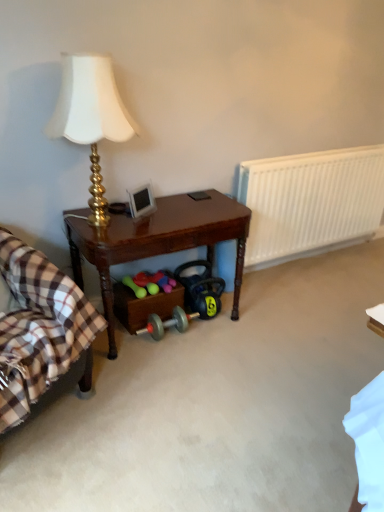
Question: From the image's perspective, relative to brown wooden table at center, is plaid fabric at left above or below?

Choices:
 (A) above
 (B) below

Answer: (B)

Question: From a real-world perspective, is plaid fabric at left above or below brown wooden table at center?

Choices:
 (A) below
 (B) above

Answer: (B)

Question: Estimate the real-world distances between objects in this image. Which object is closer to the white plastic radiator at right?

Choices:
 (A) brown wooden table at center
 (B) plaid fabric at left
 (C) gold metallic lamp at upper left

Answer: (A)

Question: Which object is positioned farthest from the plaid fabric at left?

Choices:
 (A) white plastic radiator at right
 (B) gold metallic lamp at upper left
 (C) brown wooden table at center

Answer: (A)